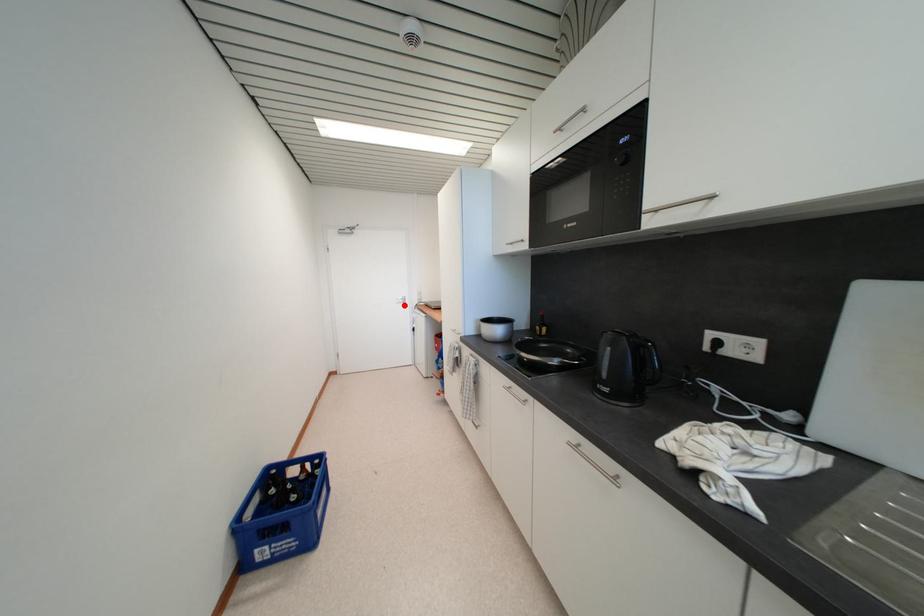
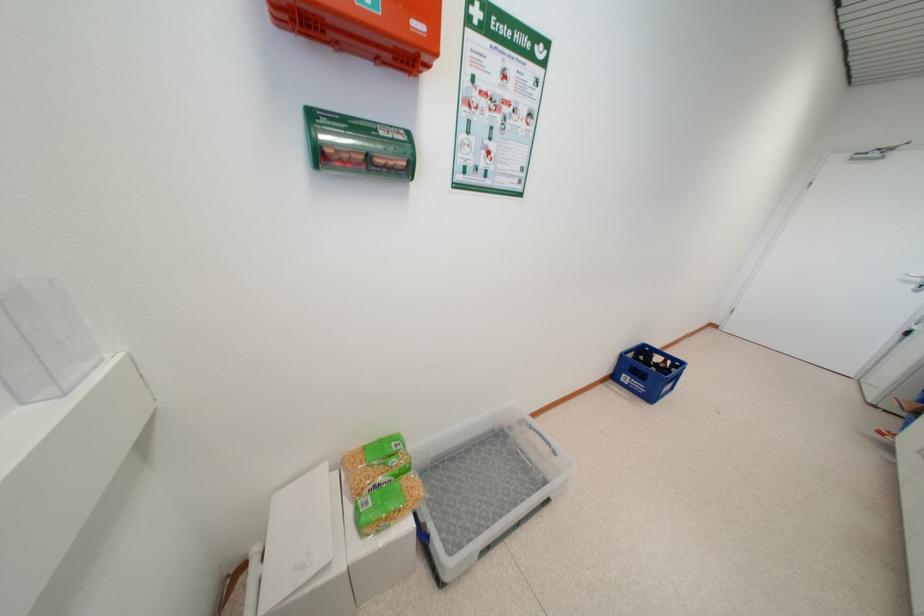
Question: I am providing you with two images of the same scene from different viewpoints. A red point is shown in image1. For the corresponding object point in image2, is it positioned nearer or farther from the camera?

Choices:
 (A) Nearer
 (B) Farther

Answer: (B)